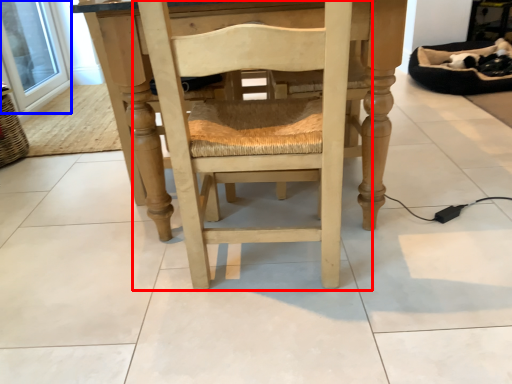
Question: Which of the following is the farthest to the observer, chair (highlighted by a red box) or window screen (highlighted by a blue box)?

Choices:
 (A) chair
 (B) window screen

Answer: (B)